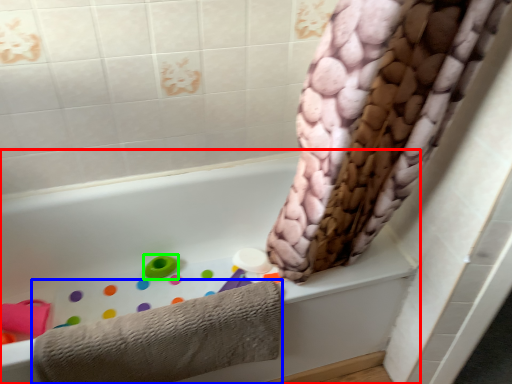
Question: Considering the real-world distances, which object is closest to bathtub (highlighted by a red box)? towel (highlighted by a blue box) or toy (highlighted by a green box).

Choices:
 (A) towel
 (B) toy

Answer: (B)